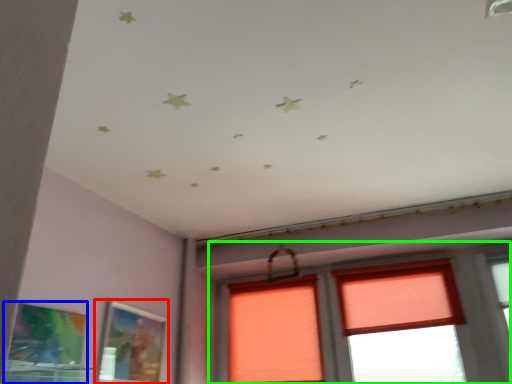
Question: Which is nearer to the picture frame (highlighted by a red box)? picture frame (highlighted by a blue box) or window (highlighted by a green box).

Choices:
 (A) picture frame
 (B) window

Answer: (A)